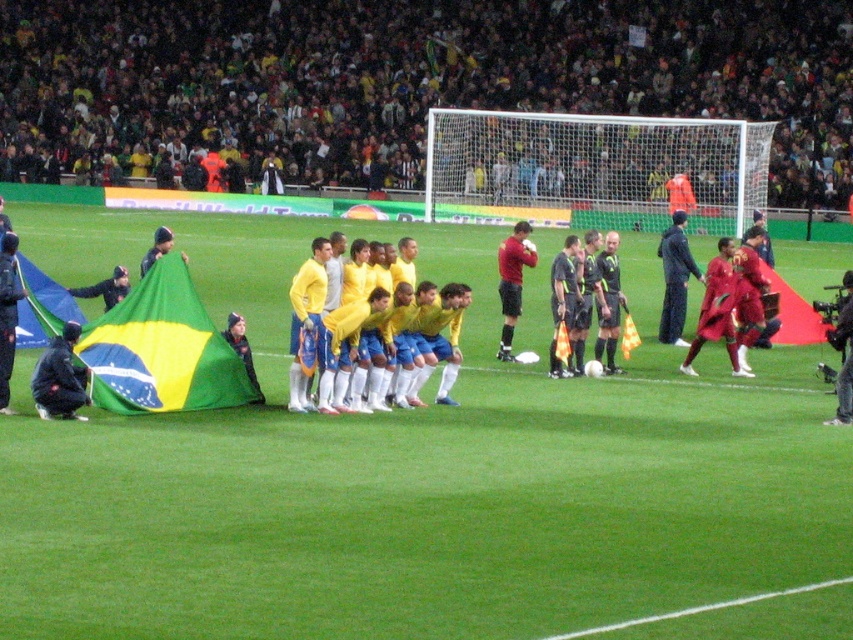
Question: Is black matte jacket at lower left to the left of matte red shirt at center from the viewer's perspective?

Choices:
 (A) yes
 (B) no

Answer: (A)

Question: Which of the following is the closest to the observer?

Choices:
 (A) (33, 244)
 (B) (35, 387)

Answer: (B)

Question: Is green grass field at center bigger than matte red shirt at center?

Choices:
 (A) no
 (B) yes

Answer: (B)

Question: Is green grass field at center smaller than black matte jacket at lower left?

Choices:
 (A) yes
 (B) no

Answer: (B)

Question: Estimate the real-world distances between objects in this image. Which object is farther from the yellow matte/synthetic uniform at center?

Choices:
 (A) dark blue fabric jacket at center
 (B) black matte jacket at lower left

Answer: (A)

Question: Considering the real-world distances, which object is closest to the white synthetic grass at lower center?

Choices:
 (A) yellow matte/synthetic uniform at center
 (B) black matte jacket at lower left
 (C) dark blue fabric jacket at center
 (D) green grass field at center

Answer: (D)